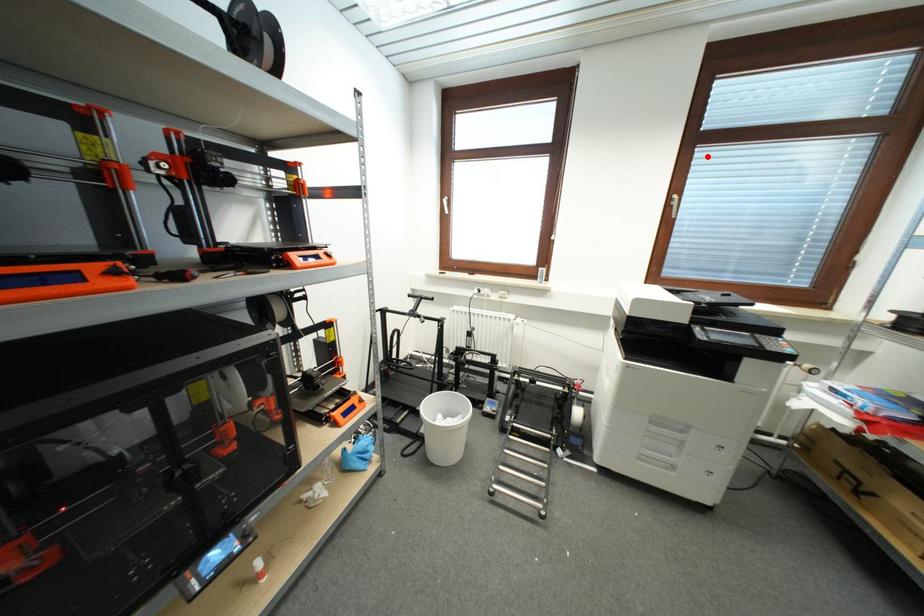
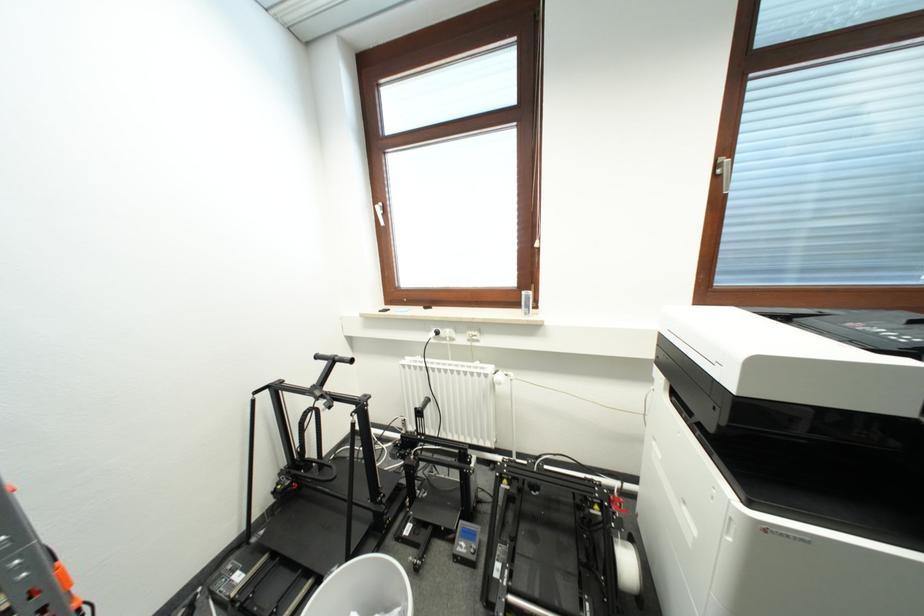
Find the pixel in the second image that matches the highlighted location in the first image.

(766, 89)